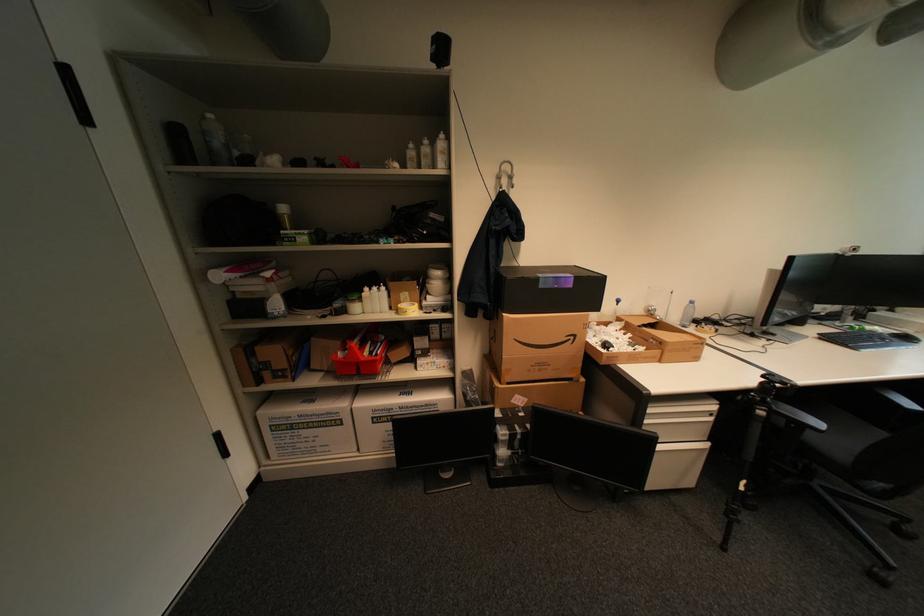
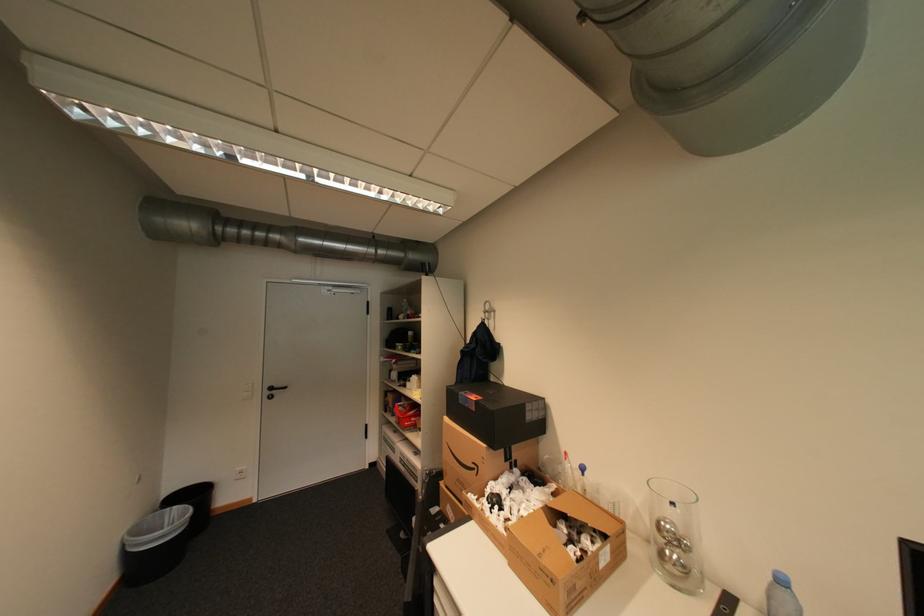
The point at (x=580, y=338) is marked in the first image. Where is the corresponding point in the second image?

(484, 468)